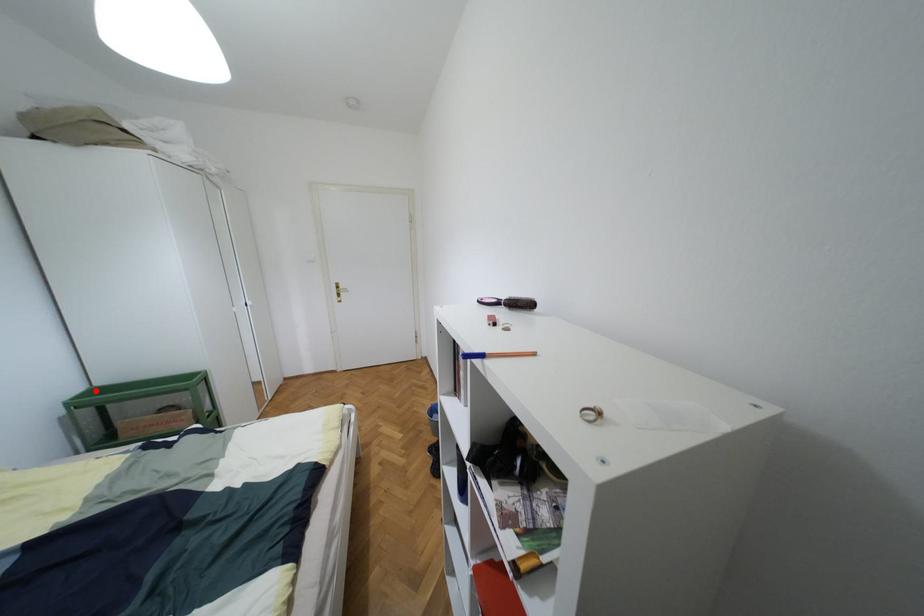
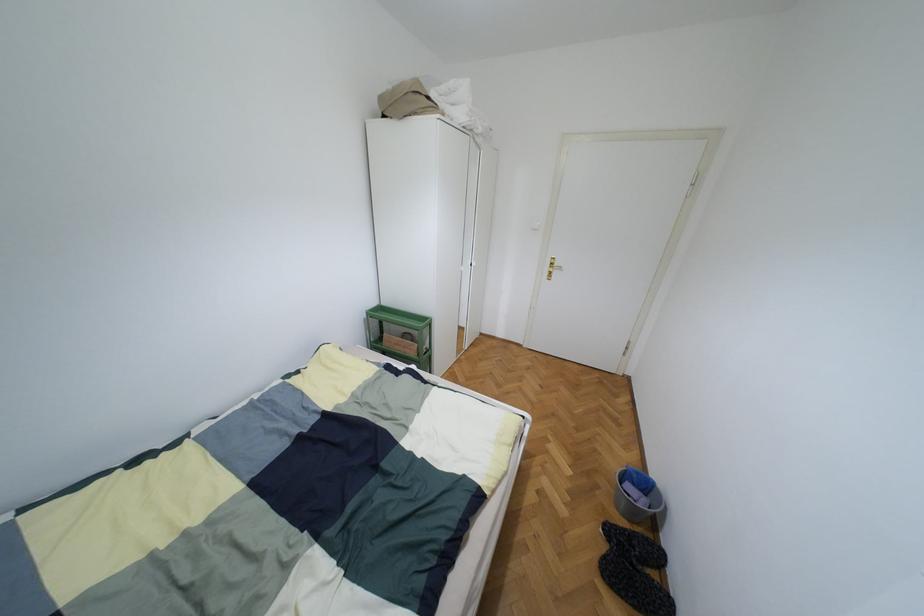
The point at the highlighted location is marked in the first image. Where is the corresponding point in the second image?

(380, 307)